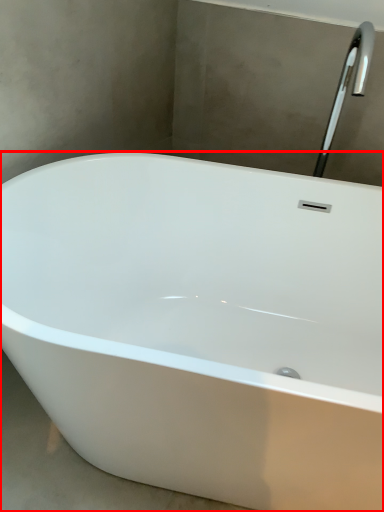
Question: In this image, where is bathtub (annotated by the red box) located relative to tap?

Choices:
 (A) right
 (B) left

Answer: (B)